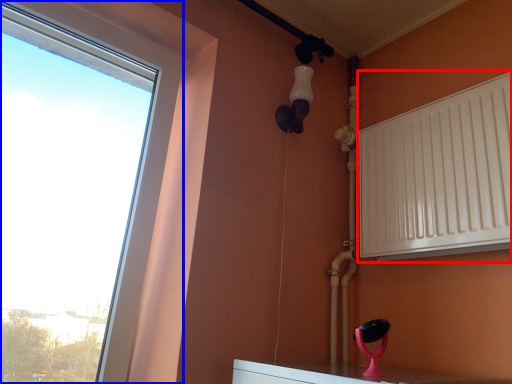
Question: Which object appears farthest to the camera in this image, radiator (highlighted by a red box) or window (highlighted by a blue box)?

Choices:
 (A) radiator
 (B) window

Answer: (A)